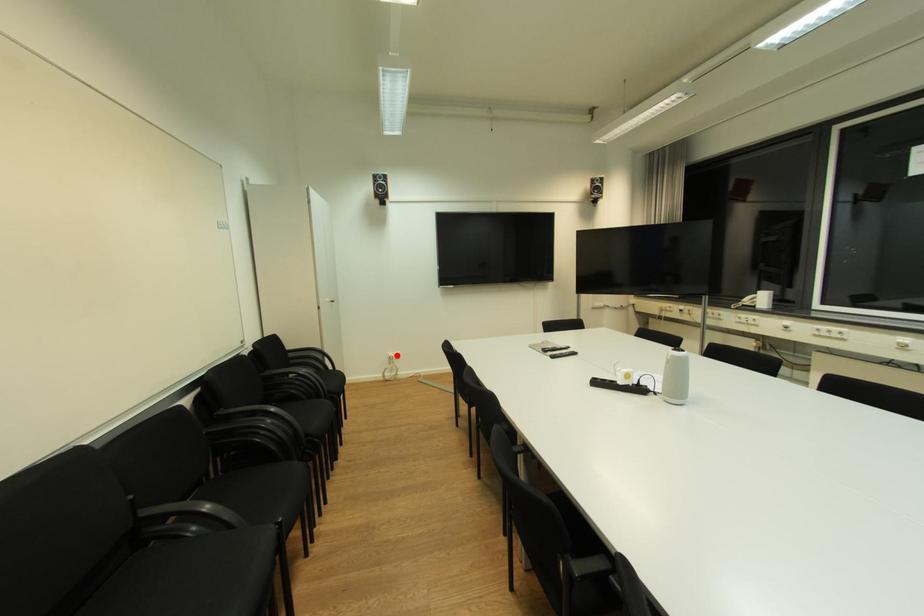
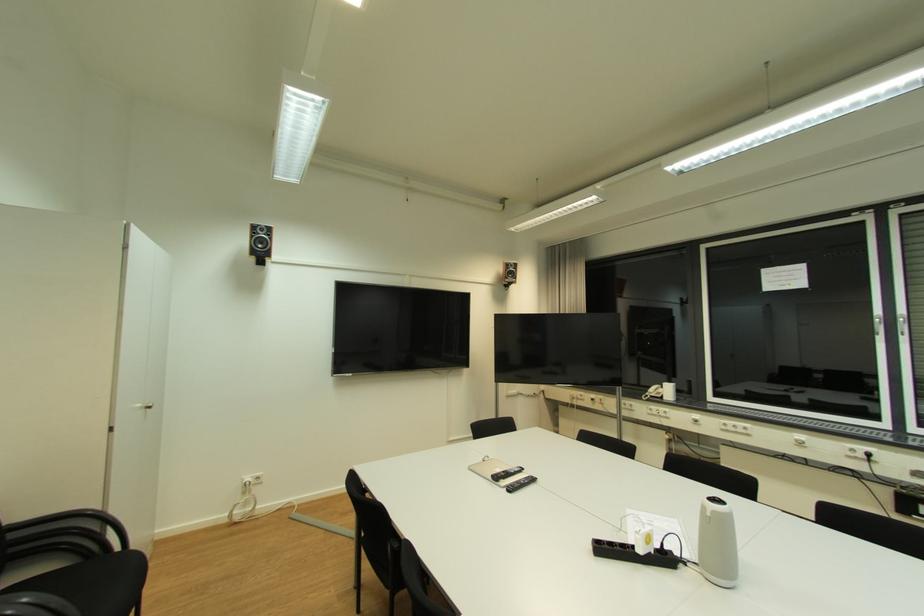
Where in the second image is the point corresponding to the highlighted location from the first image?

(253, 480)